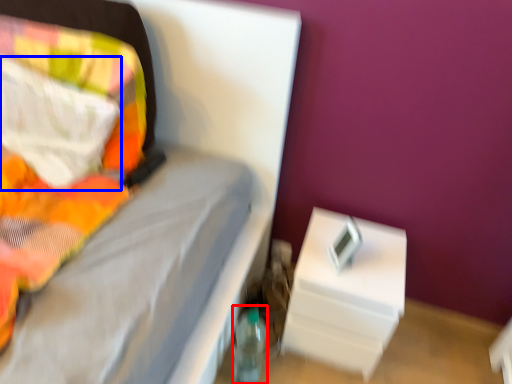
Question: Which object appears farthest to the camera in this image, bottle (highlighted by a red box) or pillow (highlighted by a blue box)?

Choices:
 (A) bottle
 (B) pillow

Answer: (A)